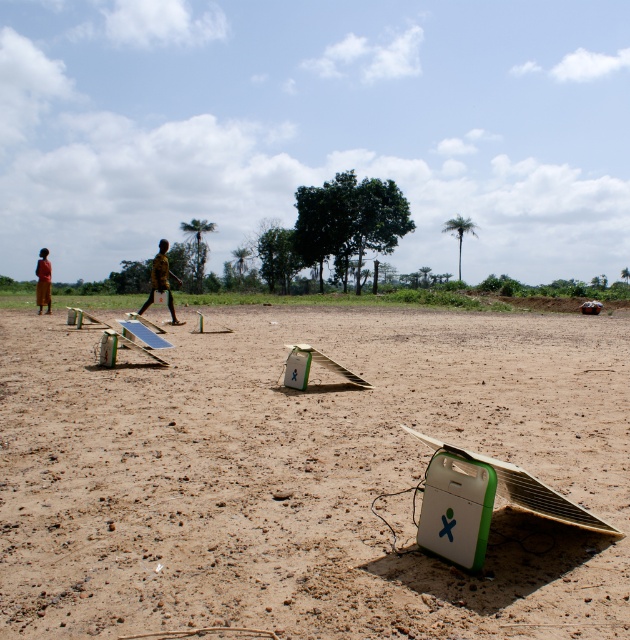
Question: Among these objects, which one is farthest from the camera?

Choices:
 (A) red fabric person at left
 (B) yellow matte shirt at center
 (C) brown sandy dirt at center

Answer: (A)

Question: Among these points, which one is farthest from the camera?

Choices:
 (A) (171, 316)
 (B) (43, 301)
 (C) (71, 508)

Answer: (B)

Question: Which of these objects is positioned closest to the yellow matte shirt at center?

Choices:
 (A) red fabric person at left
 (B) brown sandy dirt at center

Answer: (B)

Question: Observing the image, what is the correct spatial positioning of yellow matte shirt at center in reference to red fabric person at left?

Choices:
 (A) right
 (B) left

Answer: (A)

Question: Can you confirm if brown sandy dirt at center is positioned below yellow matte shirt at center?

Choices:
 (A) yes
 (B) no

Answer: (A)

Question: From the image, what is the correct spatial relationship of brown sandy dirt at center in relation to red fabric person at left?

Choices:
 (A) right
 (B) left

Answer: (A)